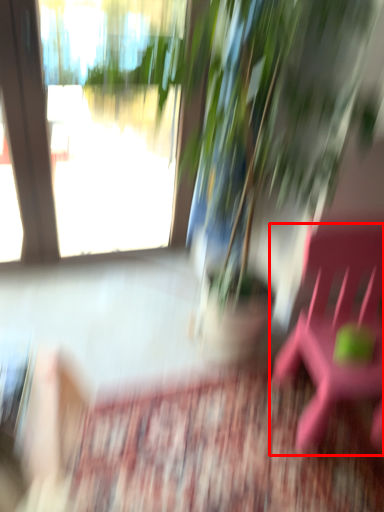
Question: From the image's perspective, where is beach chair (annotated by the red box) located relative to houseplant?

Choices:
 (A) above
 (B) below

Answer: (B)